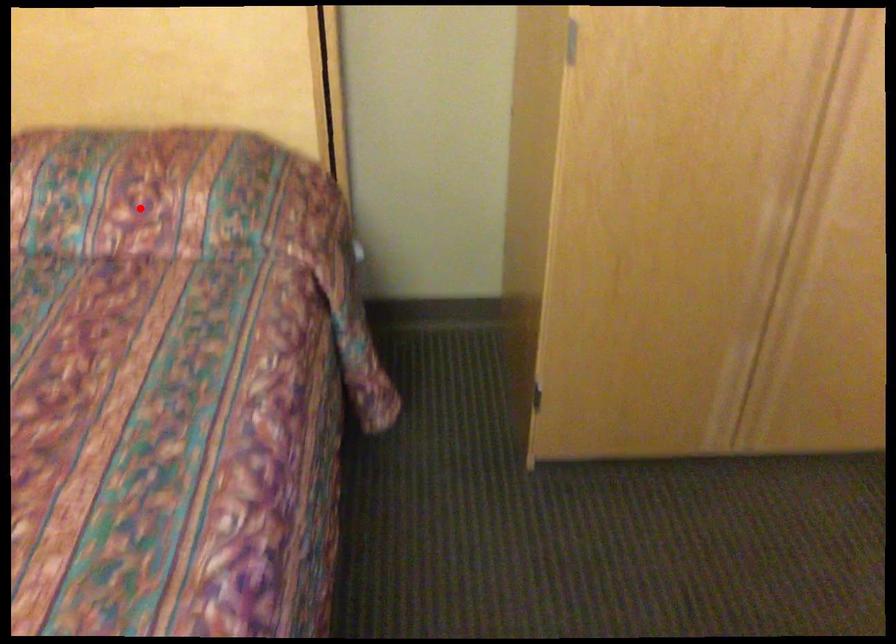
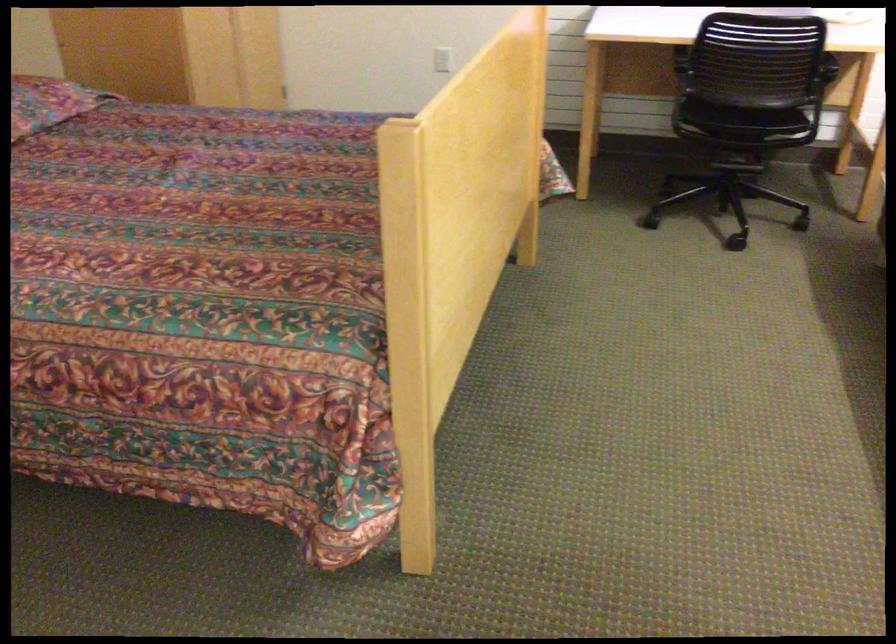
Where in the second image is the point corresponding to the highlighted location from the first image?

(48, 102)